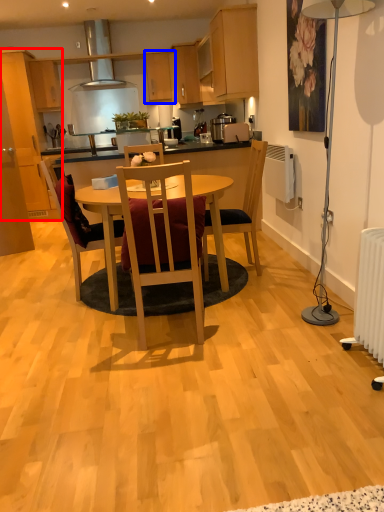
Question: Which point is closer to the camera, cabinetry (highlighted by a red box) or cabinetry (highlighted by a blue box)?

Choices:
 (A) cabinetry
 (B) cabinetry

Answer: (A)